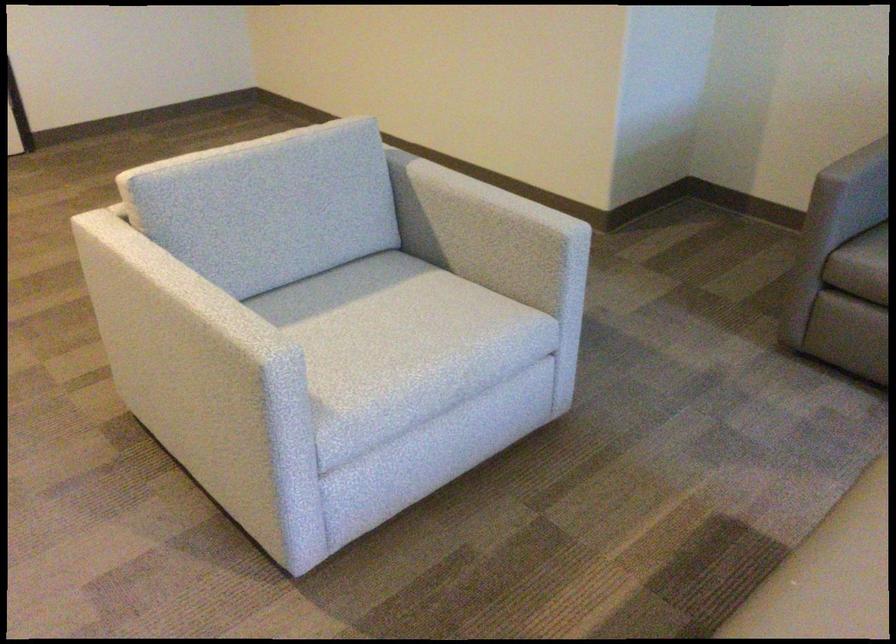
Locate an element on the screen. The image size is (896, 644). sofa armrest is located at coordinates (858, 164).